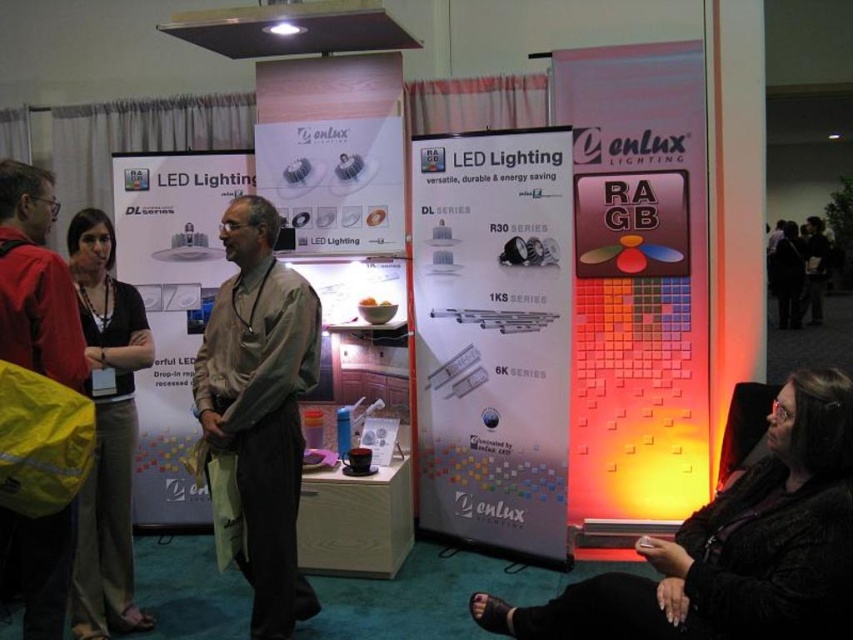
Does matte black shirt at left appear on the right side of red jacket at left?

No, matte black shirt at left is not to the right of red jacket at left.

What do you see at coordinates (106, 432) in the screenshot?
I see `matte black shirt at left` at bounding box center [106, 432].

Which is in front, point (102, 241) or point (36, 305)?

Point (36, 305) is in front.

The image size is (853, 640). I want to click on matte black shirt at left, so click(106, 432).

Who is lower down, matte plastic poster at right or light brown fabric shirt at center?

light brown fabric shirt at center is below.

Who is positioned more to the left, matte plastic poster at right or light brown fabric shirt at center?

light brown fabric shirt at center

What do you see at coordinates (637, 284) in the screenshot? This screenshot has height=640, width=853. I see `matte plastic poster at right` at bounding box center [637, 284].

Locate an element on the screen. The width and height of the screenshot is (853, 640). matte plastic poster at right is located at coordinates (637, 284).

Is point (263, 584) behind point (122, 273)?

That is False.

Does point (299, 476) come in front of point (129, 205)?

Yes, point (299, 476) is in front of point (129, 205).

Locate an element on the screen. Image resolution: width=853 pixels, height=640 pixels. light brown fabric shirt at center is located at coordinates (260, 404).